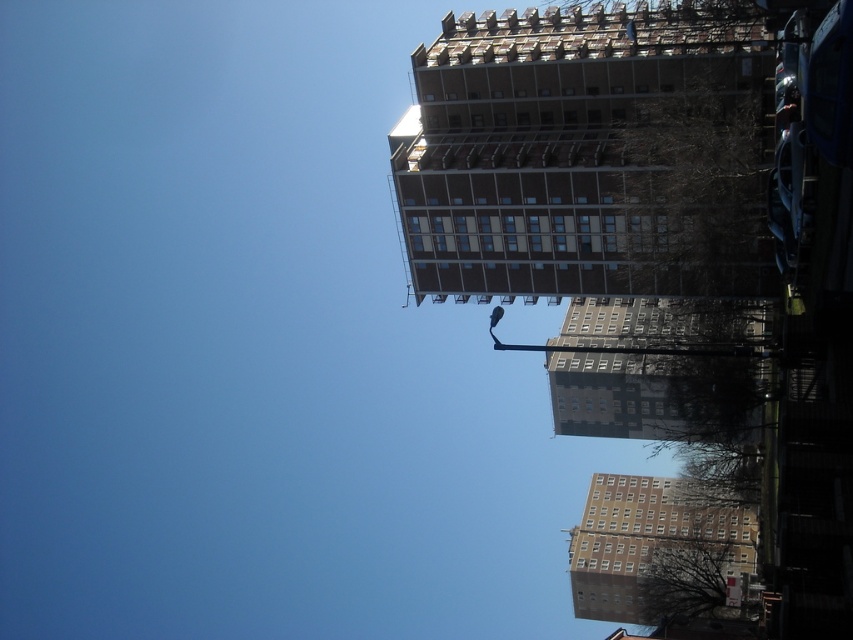
Image resolution: width=853 pixels, height=640 pixels. What do you see at coordinates (567, 150) in the screenshot?
I see `brown brick building at upper center` at bounding box center [567, 150].

Which is more to the left, brown brick building at upper center or brown concrete building at lower right?

Positioned to the left is brown brick building at upper center.

Locate an element on the screen. This screenshot has height=640, width=853. brown brick building at upper center is located at coordinates (567, 150).

Which of these two, brown concrete building at lower right or gray concrete building at center, stands shorter?

gray concrete building at center

Which is more to the right, brown concrete building at lower right or gray concrete building at center?

brown concrete building at lower right

What do you see at coordinates (659, 548) in the screenshot? This screenshot has width=853, height=640. I see `brown concrete building at lower right` at bounding box center [659, 548].

You are a GUI agent. You are given a task and a screenshot of the screen. Output one action in this format:
    pyautogui.click(x=<x>, y=<y>)
    Task: Click on the brown concrete building at lower right
    This screenshot has width=853, height=640.
    Given the screenshot: What is the action you would take?
    pyautogui.click(x=659, y=548)

Is point (723, 35) closer to camera compared to point (631, 397)?

Yes, point (723, 35) is in front of point (631, 397).

This screenshot has height=640, width=853. I want to click on brown brick building at upper center, so [x=567, y=150].

Find the location of a particular element. brown brick building at upper center is located at coordinates (567, 150).